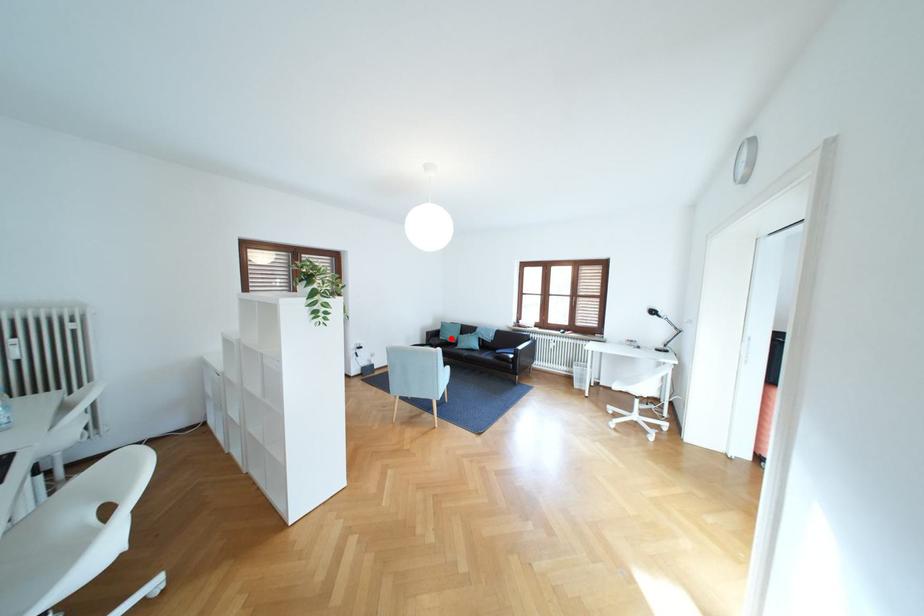
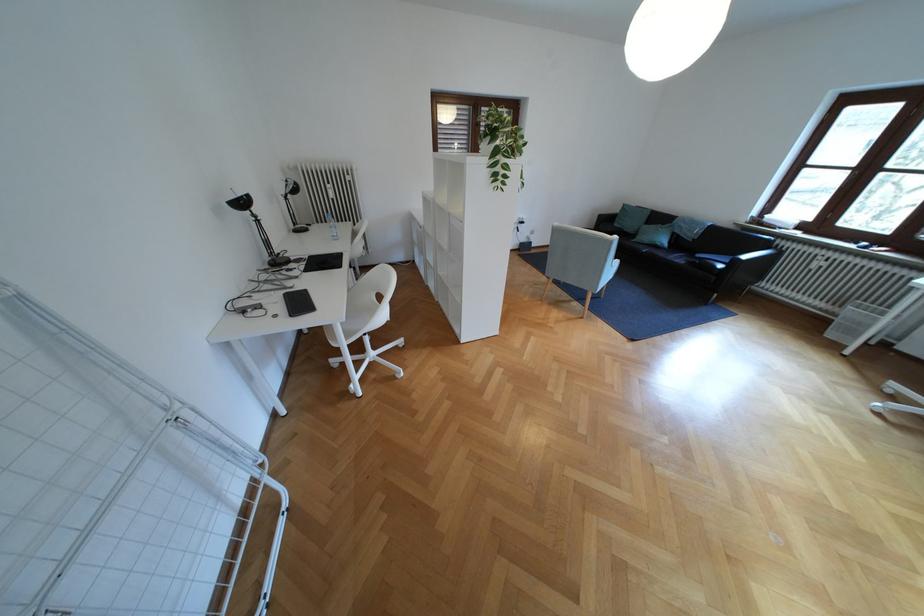
In the second image, find the point that corresponds to the highlighted location in the first image.

(626, 225)